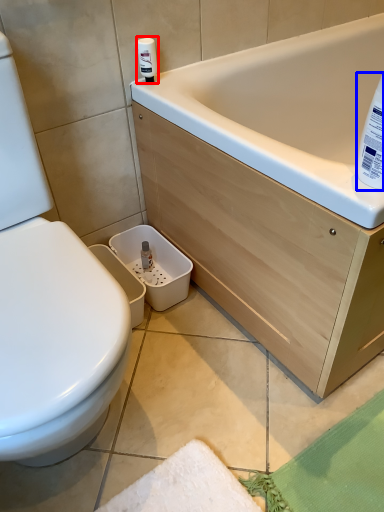
Question: Which object is closer to the camera taking this photo, cleaning product (highlighted by a red box) or cleaning product (highlighted by a blue box)?

Choices:
 (A) cleaning product
 (B) cleaning product

Answer: (B)